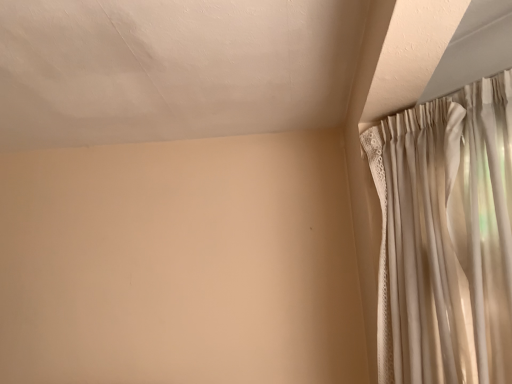
The width and height of the screenshot is (512, 384). What do you see at coordinates (446, 237) in the screenshot?
I see `white lace curtain at upper right` at bounding box center [446, 237].

I want to click on white lace curtain at upper right, so click(x=446, y=237).

The image size is (512, 384). I want to click on white lace curtain at upper right, so click(x=446, y=237).